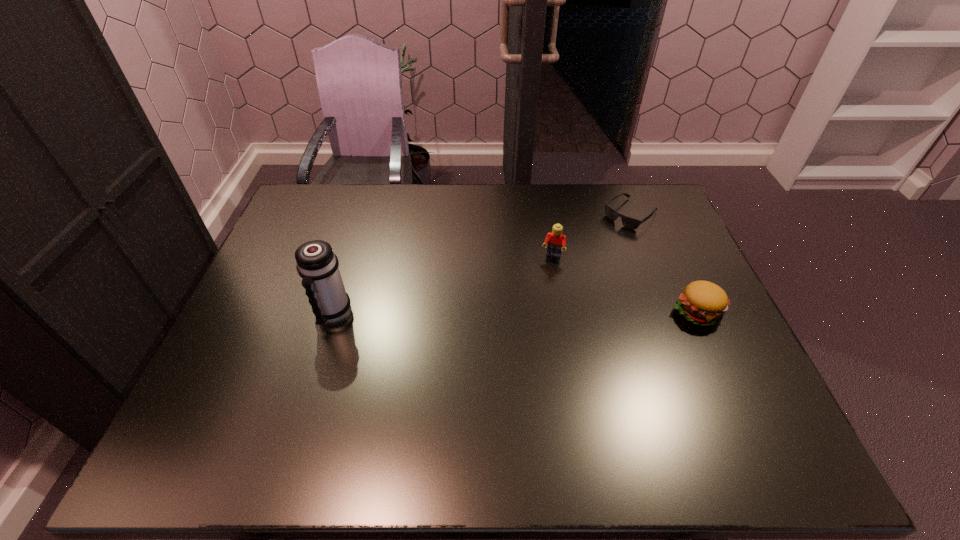
The height and width of the screenshot is (540, 960). I want to click on free point between the Lego and the thermos bottle, so pos(443,286).

Locate an element on the screen. unoccupied position between the shortest object and the leftmost object is located at coordinates (482, 265).

The height and width of the screenshot is (540, 960). I want to click on empty location between the shortest object and the leftmost object, so click(482, 265).

This screenshot has width=960, height=540. In order to click on vacant point located between the third tallest object and the farthest object in this screenshot , I will do `click(663, 262)`.

I want to click on free spot between the second object from left to right and the hamburger, so click(x=625, y=284).

Identify which object is the third nearest to the hamburger. Please provide its 2D coordinates. Your answer should be formatted as a tuple, i.e. [(x, y)], where the tuple contains the x and y coordinates of a point satisfying the conditions above.

[(317, 265)]

Locate which object is the third closest to the third object from right to left. Please provide its 2D coordinates. Your answer should be formatted as a tuple, i.e. [(x, y)], where the tuple contains the x and y coordinates of a point satisfying the conditions above.

[(317, 265)]

Locate an element on the screen. This screenshot has height=540, width=960. free space that satisfies the following two spatial constraints: 1. on the back side of the sunglasses; 2. on the right side of the second farthest object is located at coordinates tap(545, 214).